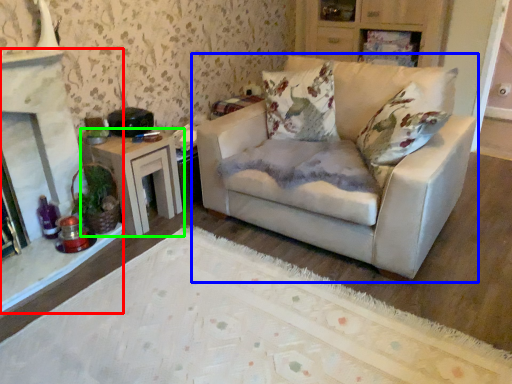
Question: Which is nearer to the fireplace (highlighted by a red box)? studio couch (highlighted by a blue box) or table (highlighted by a green box).

Choices:
 (A) studio couch
 (B) table

Answer: (B)